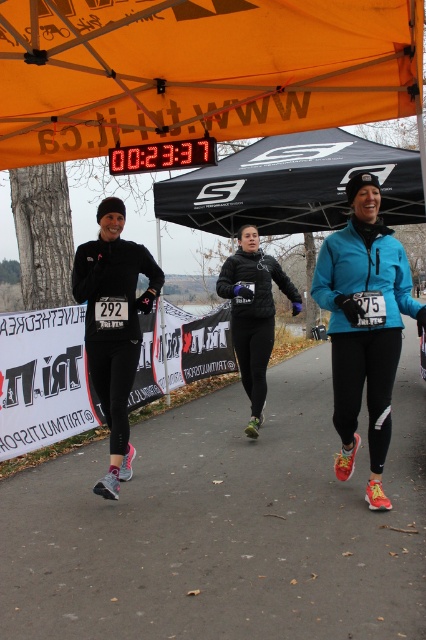
You are a photographer standing at the starting line of the race. You want to capture a photo of the matte blue jacket at center without the orange fabric canopy at upper center appearing in the background. Given that your camera has a focal length of 50mm and a depth of field that can blur objects beyond 2 meters away from the subject, can you achieve this?

The distance between the orange fabric canopy at upper center and the matte blue jacket at center is 1.93 meters. Since the depth of field blurs objects beyond 2 meters away, the orange fabric canopy is within the blur range and would not be sharply visible in the background. Therefore, you can capture the photo as desired.

You are a photographer at the race and want to capture a photo that includes both the orange fabric canopy at upper center and the matte blue jacket at center. Since you want to highlight the canopy, which object should be placed on the sides of the frame to ensure the canopy takes up more space?

The orange fabric canopy at upper center should be placed in the center of the frame because its width surpasses that of the matte blue jacket at center, allowing it to occupy more space and be the focal point.

You are a photographer at the race and want to capture both the matte blue jacket at center and the black quilted jacket at center in a single frame. Which jacket should you focus on to ensure both are fully visible without cropping?

The matte blue jacket at center has a lesser width compared to the black quilted jacket at center, so focusing on the wider black quilted jacket at center ensures both jackets are fully visible in the frame.